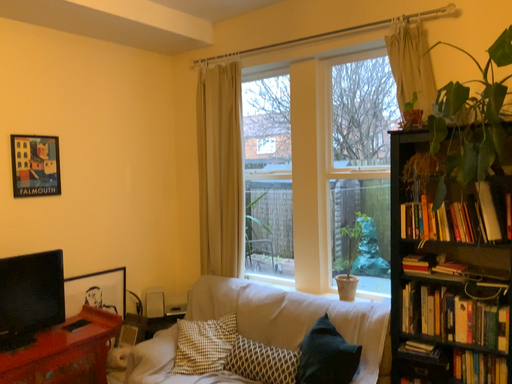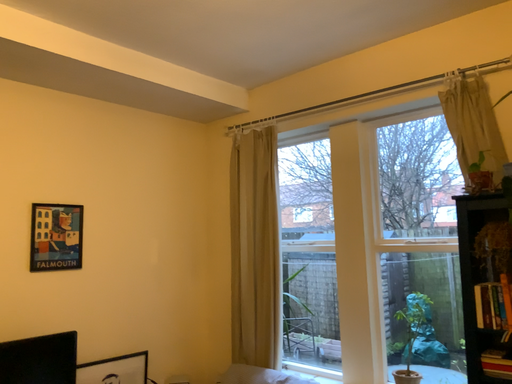
Question: How did the camera likely rotate when shooting the video?

Choices:
 (A) rotated upward
 (B) rotated downward

Answer: (A)